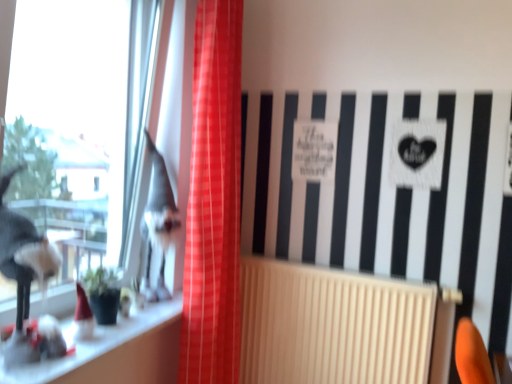
Question: From a real-world perspective, is shiny silver figurine at left physically located above or below red plaid curtain at center?

Choices:
 (A) below
 (B) above

Answer: (A)

Question: Considering the relative positions of shiny silver figurine at left and red plaid curtain at center in the image provided, is shiny silver figurine at left to the left or to the right of red plaid curtain at center?

Choices:
 (A) right
 (B) left

Answer: (B)

Question: Considering the real-world distances, which object is farthest from the beige ribbed radiator at center?

Choices:
 (A) shiny silver figurine at left
 (B) white glossy window sill at lower left
 (C) red plaid curtain at center
 (D) transparent glass window at left

Answer: (D)

Question: Which of these objects is positioned closest to the red plaid curtain at center?

Choices:
 (A) transparent glass window at left
 (B) beige ribbed radiator at center
 (C) white glossy window sill at lower left
 (D) shiny silver figurine at left

Answer: (D)